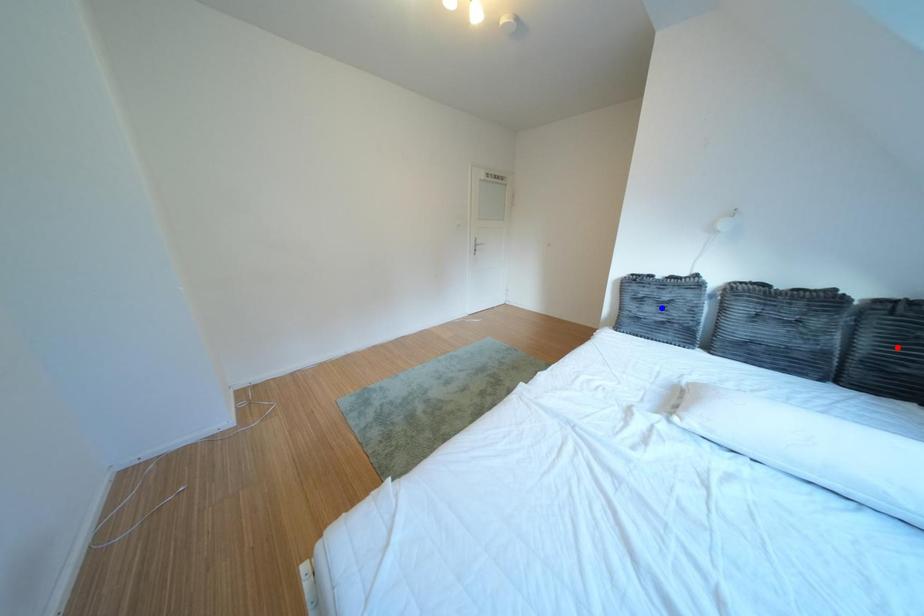
Question: Two points are marked on the image. Which point is closer to the camera?

Choices:
 (A) Blue point is closer.
 (B) Red point is closer.

Answer: (B)